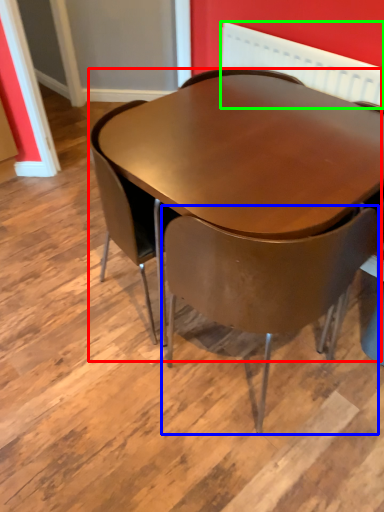
Question: Which object is positioned closest to table (highlighted by a red box)? Select from chair (highlighted by a blue box) and radiator (highlighted by a green box).

Choices:
 (A) chair
 (B) radiator

Answer: (A)